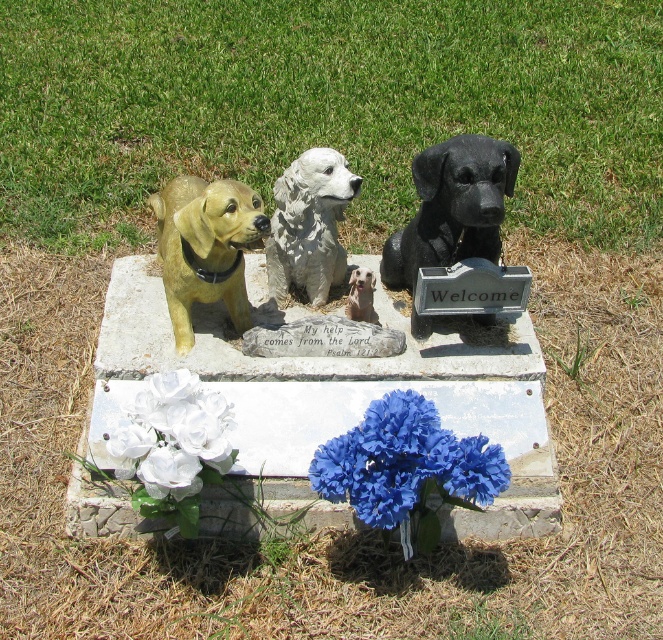
Can you confirm if shiny black statue at center is taller than white silk flowers at lower left?

Yes.

Is shiny black statue at center above white silk flowers at lower left?

Indeed, shiny black statue at center is positioned over white silk flowers at lower left.

This screenshot has height=640, width=663. I want to click on shiny black statue at center, so click(x=452, y=205).

Between blue fabric flowers at center and white silk flowers at lower left, which one has less height?

With less height is white silk flowers at lower left.

Between point (420, 476) and point (154, 419), which one is positioned in front?

Positioned in front is point (420, 476).

This screenshot has height=640, width=663. Identify the location of blue fabric flowers at center. (404, 461).

Between golden matte dog at left and white glossy statue at center, which one appears on the right side from the viewer's perspective?

From the viewer's perspective, white glossy statue at center appears more on the right side.

Is point (184, 312) closer to camera compared to point (294, 177)?

That is False.

Describe the element at coordinates (206, 248) in the screenshot. I see `golden matte dog at left` at that location.

Locate an element on the screen. golden matte dog at left is located at coordinates (206, 248).